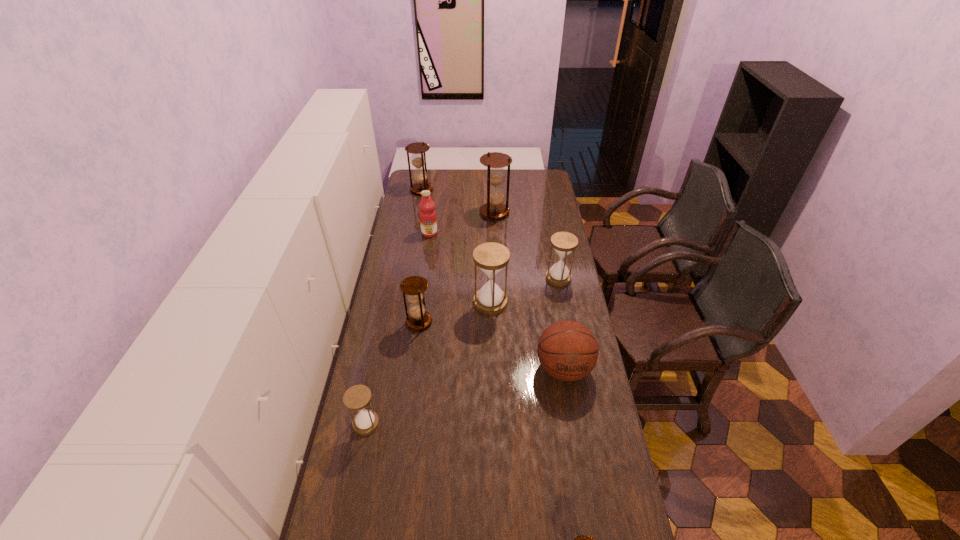
Image resolution: width=960 pixels, height=540 pixels. In order to click on the tallest hourglass in this screenshot , I will do `click(495, 161)`.

Where is `the second farthest hourglass`? the second farthest hourglass is located at coordinates (495, 161).

Identify the location of the farthest object. (418, 158).

Locate an element on the screen. The image size is (960, 540). the third smallest brown hourglass is located at coordinates (418, 158).

Locate an element on the screen. The image size is (960, 540). the biggest white hourglass is located at coordinates [491, 258].

You are a GUI agent. You are given a task and a screenshot of the screen. Output one action in this format:
    pyautogui.click(x=<x>, y=<y>)
    Task: Click on the second white hourglass from right to left
    Image resolution: width=960 pixels, height=540 pixels.
    Given the screenshot: What is the action you would take?
    pyautogui.click(x=491, y=258)

This screenshot has width=960, height=540. Identify the location of fruit juice. (428, 222).

In order to click on pink fruit juice in this screenshot , I will do `click(428, 222)`.

The width and height of the screenshot is (960, 540). What are the coordinates of `the second smallest brown hourglass` in the screenshot? It's located at (414, 286).

What are the coordinates of `the rightmost hourglass` in the screenshot? It's located at (564, 243).